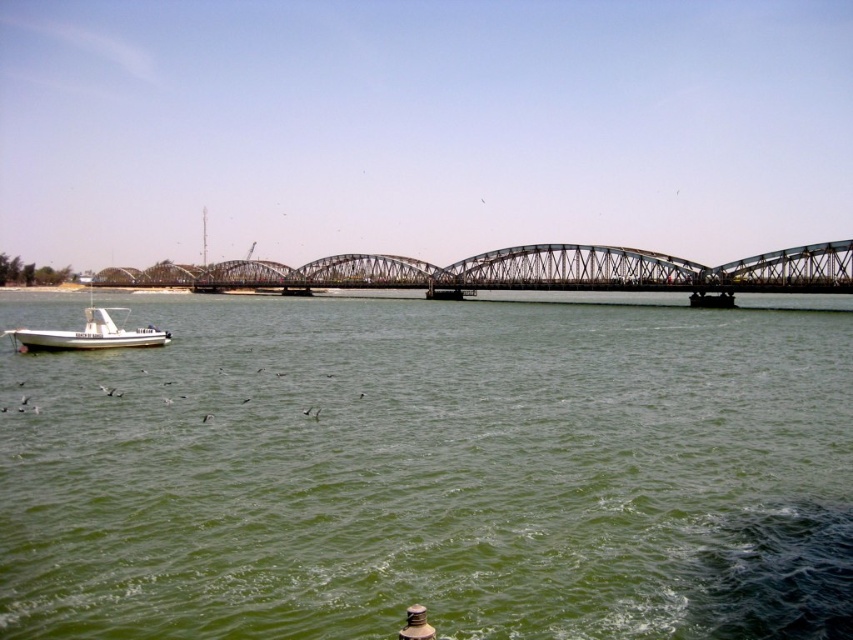
Consider the image. You are standing at the point with coordinates point [158,330] and want to look towards the point with coordinates point [373,259]. In which direction should you turn your head?

You should turn your head to your left because point [373,259] is behind point [158,330], meaning it is located to the left side when facing away from the original position.

You are standing at the point labeled point (432, 474) in the image. What color is the water at that location?

The point (432, 474) corresponds to green water at lower center, so the water there is green.

Based on the photo, you are a delivery drone that needs to fly from the metallic bridge at center to the white matte boat at lower left. The drone has a maximum flight range of 60 meters. Can it make the trip without needing to recharge?

The distance between the metallic bridge at center and the white matte boat at lower left is 61.07 meters, which exceeds the drone s 60 meter range. The drone cannot make the trip without recharging.